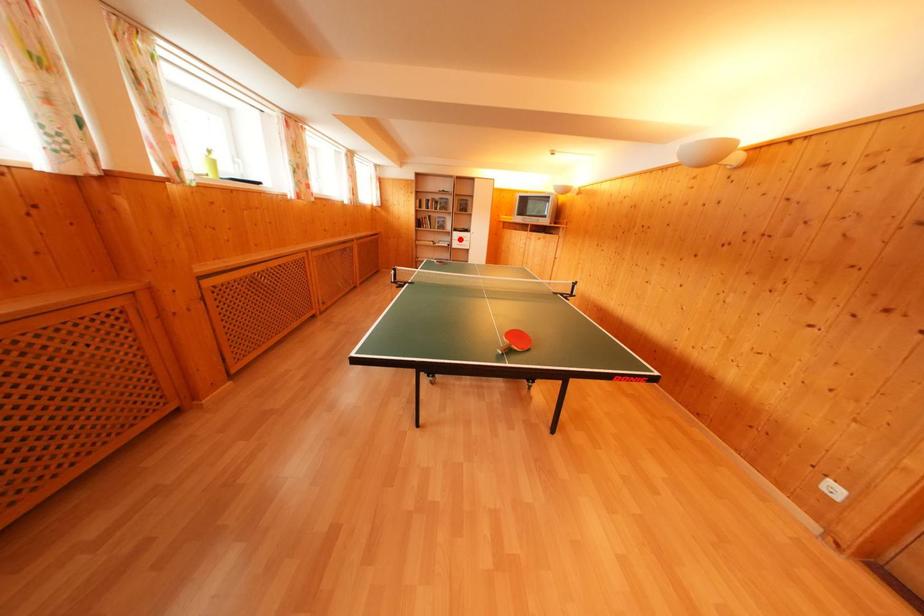
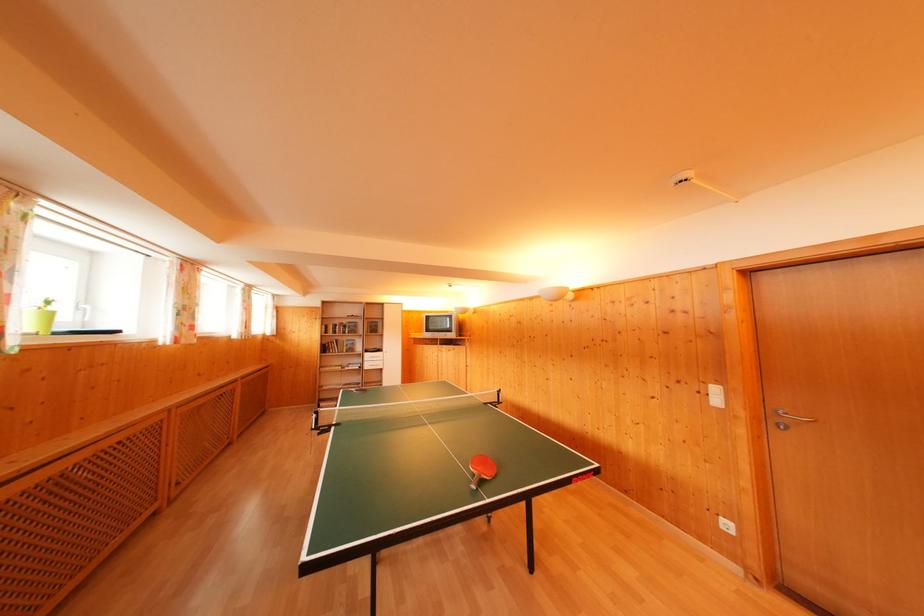
Question: I am providing you with two images of the same scene from different viewpoints. A red point is marked on the first image. Can you still see the location of the red point in image 2?

Choices:
 (A) Yes
 (B) No

Answer: (A)